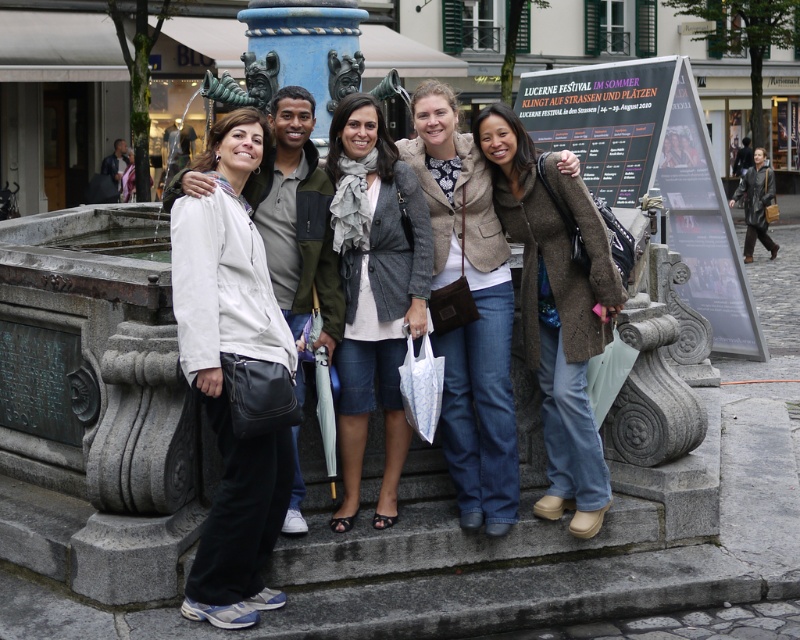
Question: Does light brown textured jacket at center appear over gray woolen scarf at center?

Choices:
 (A) yes
 (B) no

Answer: (A)

Question: Does white matte jacket at center appear on the left side of gray woolen scarf at center?

Choices:
 (A) yes
 (B) no

Answer: (A)

Question: Among these objects, which one is nearest to the camera?

Choices:
 (A) white matte jacket at center
 (B) light brown textured jacket at center

Answer: (A)

Question: Is light brown textured jacket at center above gray woolen scarf at center?

Choices:
 (A) no
 (B) yes

Answer: (B)

Question: Based on their relative distances, which object is nearer to the brown fuzzy coat at center?

Choices:
 (A) light brown textured jacket at center
 (B) gray woolen scarf at center
 (C) white matte jacket at center

Answer: (A)

Question: Which object is farther from the camera taking this photo?

Choices:
 (A) gray woolen scarf at center
 (B) brown fuzzy coat at center
 (C) light brown textured jacket at center
 (D) white matte jacket at center

Answer: (C)